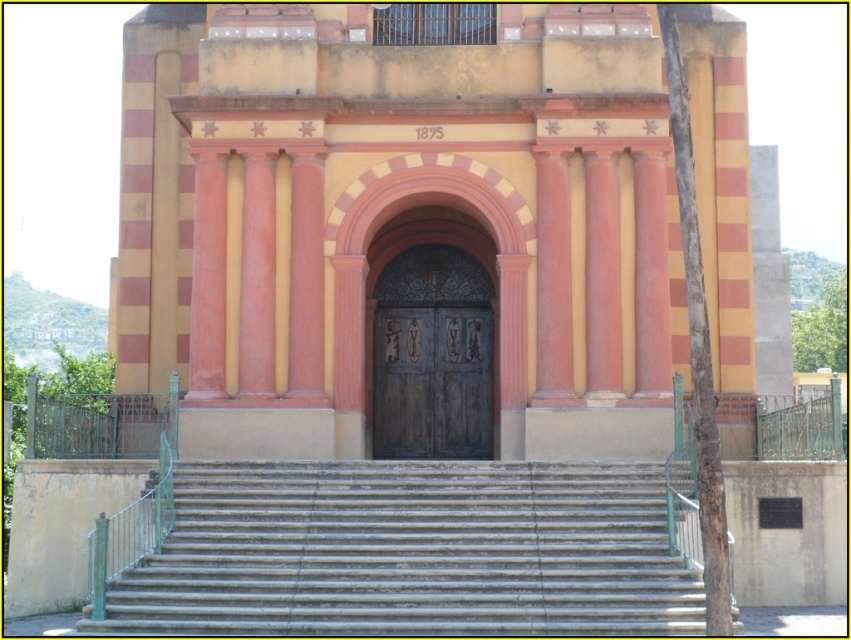
Looking at this image, how far apart are smooth concrete stairs at lower center and dark brown wooden door at center?

smooth concrete stairs at lower center is 23.83 meters away from dark brown wooden door at center.

Who is positioned more to the right, smooth concrete stairs at lower center or dark brown wooden door at center?

From the viewer's perspective, dark brown wooden door at center appears more on the right side.

Locate an element on the screen. The width and height of the screenshot is (851, 640). smooth concrete stairs at lower center is located at coordinates (410, 552).

I want to click on smooth concrete stairs at lower center, so click(x=410, y=552).